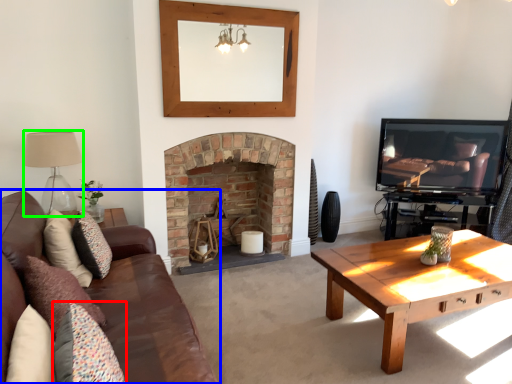
Question: Estimate the real-world distances between objects in this image. Which object is closer to pillow (highlighted by a red box), studio couch (highlighted by a blue box) or lamp (highlighted by a green box)?

Choices:
 (A) studio couch
 (B) lamp

Answer: (A)